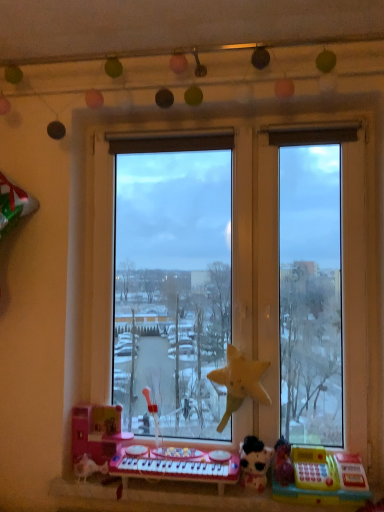
The image size is (384, 512). Find the location of `free point above plastic toy keyboard at lower center (from a real-world perspective)`. free point above plastic toy keyboard at lower center (from a real-world perspective) is located at coordinates (216, 492).